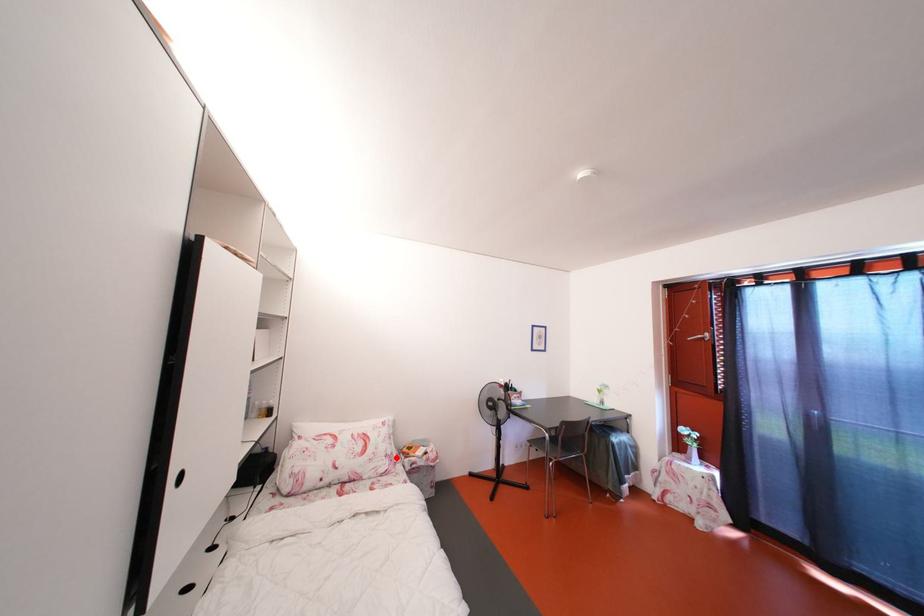
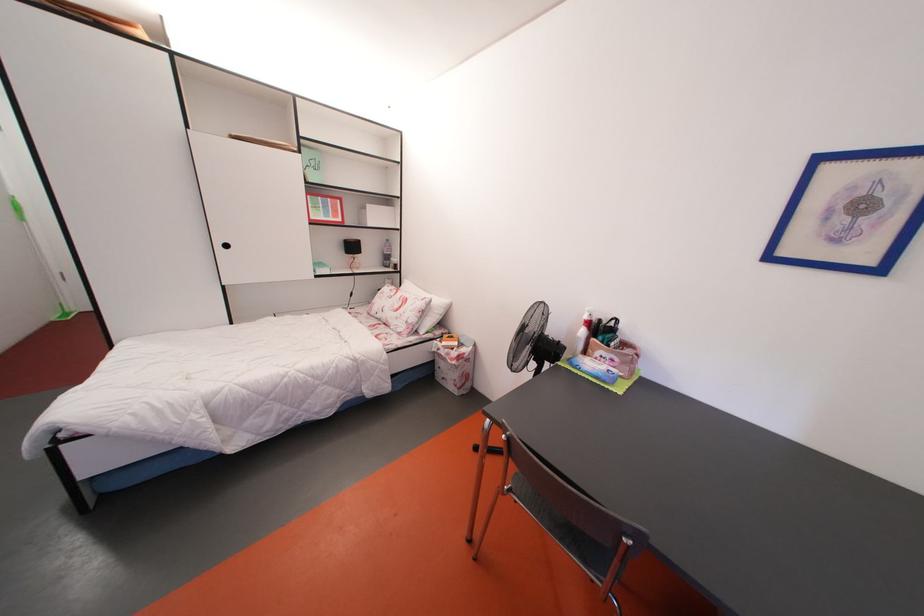
In the second image, find the point that corresponds to the highlighted location in the first image.

(417, 326)